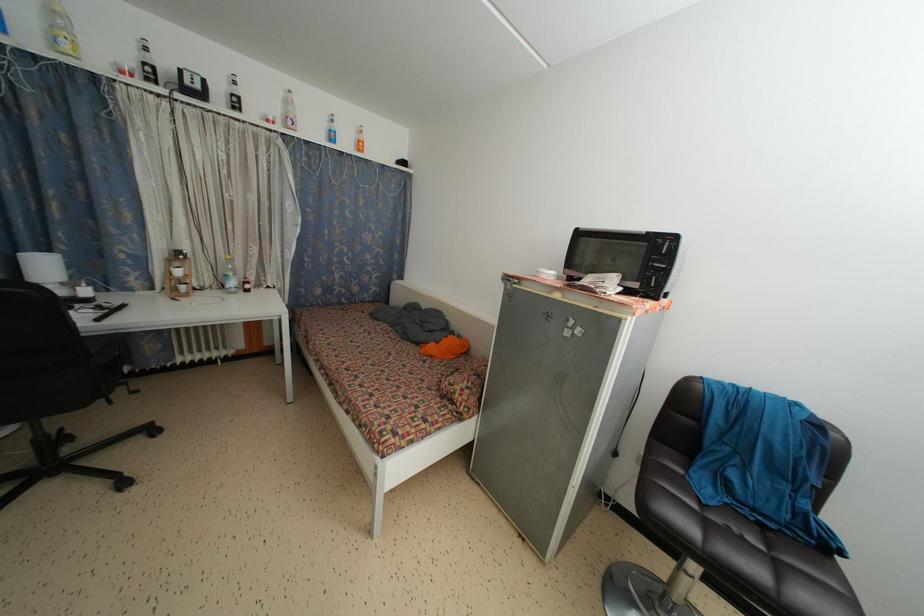
The height and width of the screenshot is (616, 924). I want to click on black chair sitting surface, so click(x=744, y=549).